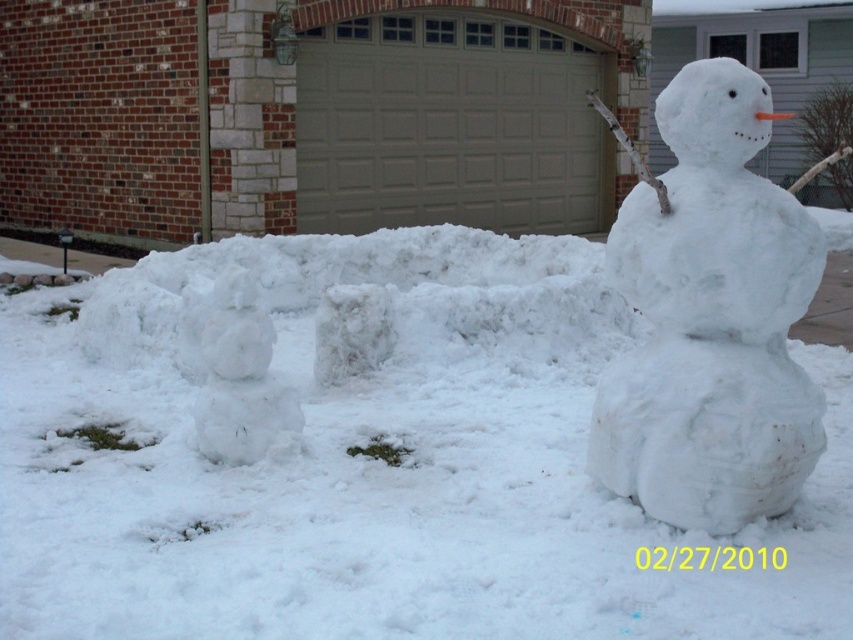
You are standing in front of the snowy scene with two snowmen. There are two points marked in the image. The first point is at coordinates point (x=44, y=339) and the second point is at point (x=392, y=166). Which of these points is closer to you?

Point (x=44, y=339) is closer to the viewer than point (x=392, y=166).

You are standing in the snowy garage scene and want to know if the white fluffy snow at center can completely cover the white fluffy snowman at lower left. Based on their heights, can it?

The white fluffy snow at center is shorter than the white fluffy snowman at lower left, so it cannot completely cover the white fluffy snowman at lower left.